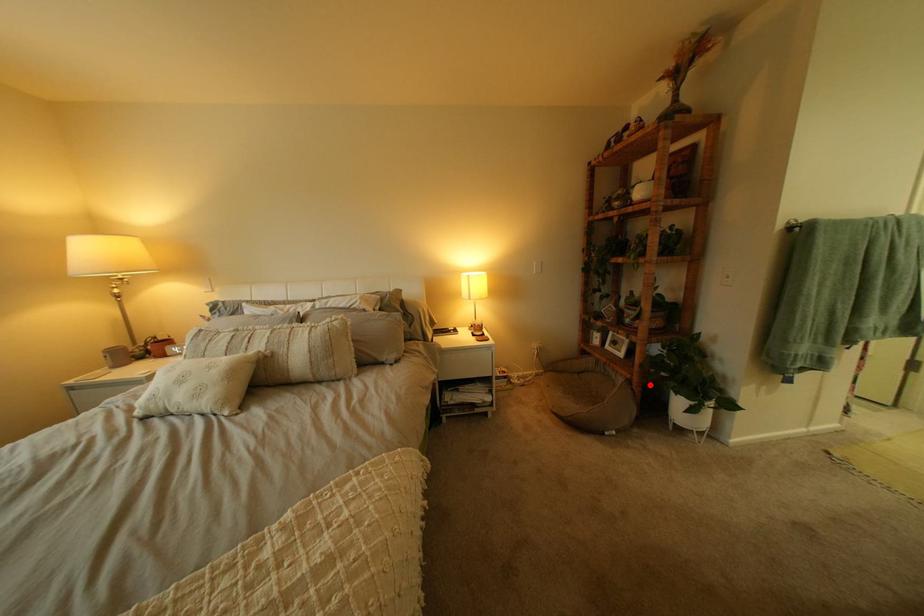
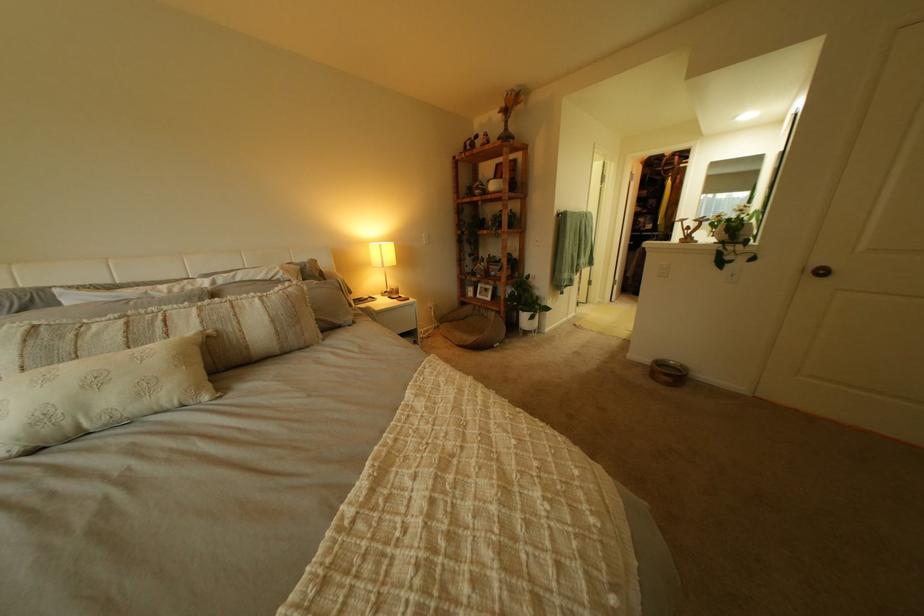
Find the pixel in the second image that matches the highlighted location in the first image.

(517, 314)